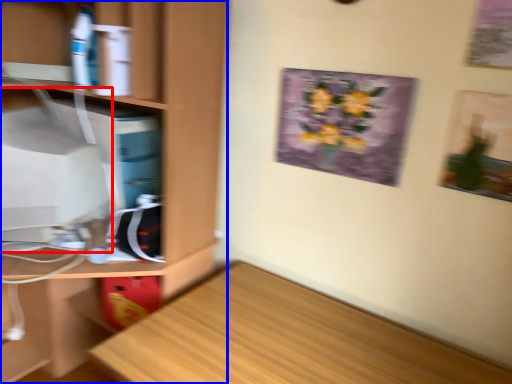
Question: Which object is further to the camera taking this photo, computer monitor (highlighted by a red box) or cabinetry (highlighted by a blue box)?

Choices:
 (A) computer monitor
 (B) cabinetry

Answer: (A)